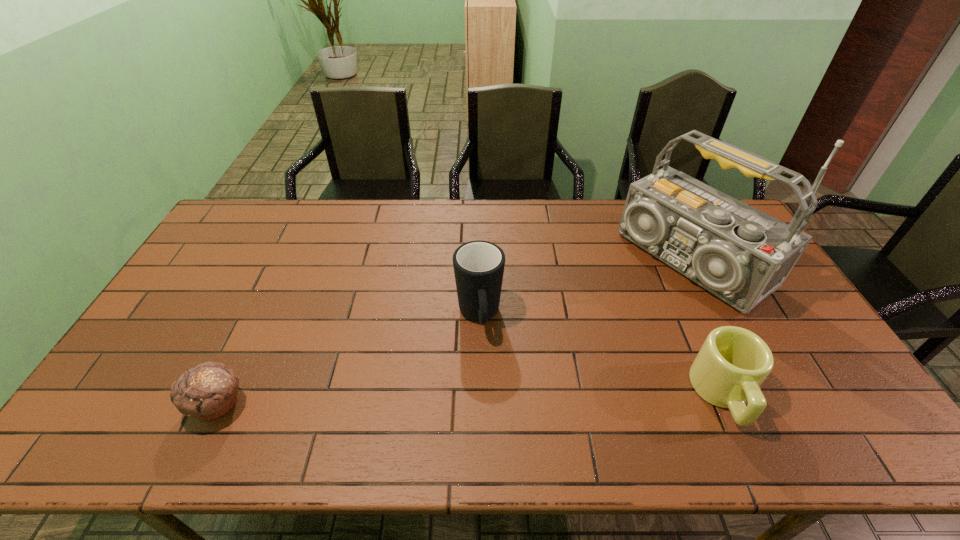
Locate an element on the screen. vacant space on the desktop that is between the shortest object and the nearer mug and is positioned on the front-facing side of the tallest object is located at coordinates (481, 399).

I want to click on vacant space on the desktop that is between the leftmost object and the right mug and is positioned on the side of the third shortest object with the handle, so click(491, 399).